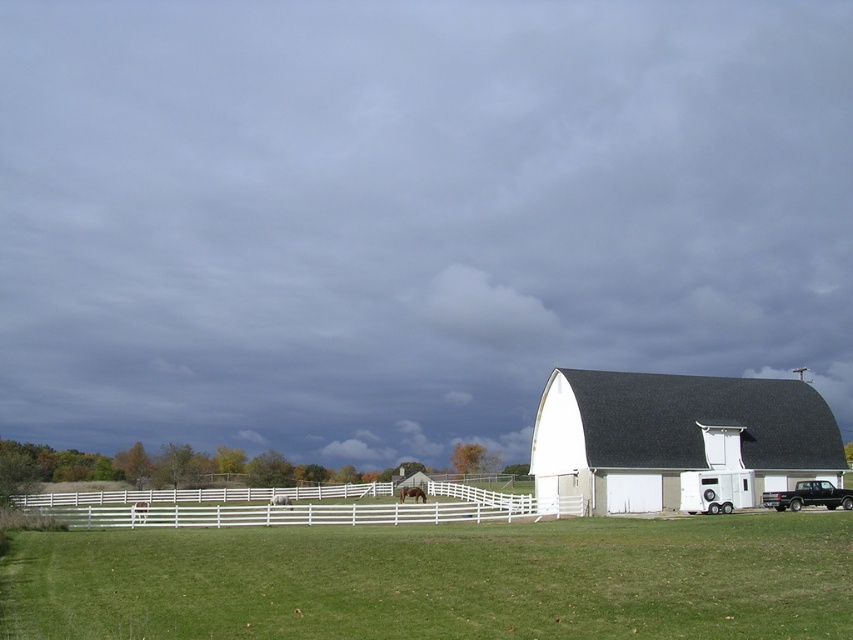
From the picture: Between white wooden fence at lower center and brown matte horse at center, which one is positioned higher?

white wooden fence at lower center is above.

Which is behind, point (142, 499) or point (418, 496)?

The point (142, 499) is behind.

This screenshot has width=853, height=640. Identify the location of white wooden fence at lower center. (289, 508).

Between brown matte horse at center and white glossy horse at center, which one is positioned lower?

white glossy horse at center is below.

Is brown matte horse at center wider than white glossy horse at center?

In fact, brown matte horse at center might be narrower than white glossy horse at center.

Which is behind, point (399, 490) or point (276, 493)?

The point (399, 490) is behind.

Find the location of a particular element. The width and height of the screenshot is (853, 640). brown matte horse at center is located at coordinates (410, 493).

Does white wooden fence at lower center have a lesser width compared to white glossy horse at center?

No, white wooden fence at lower center is not thinner than white glossy horse at center.

From the picture: Can you confirm if white wooden fence at lower center is positioned to the left of white glossy horse at center?

Yes, white wooden fence at lower center is to the left of white glossy horse at center.

This screenshot has height=640, width=853. In order to click on white wooden fence at lower center in this screenshot , I will do `click(289, 508)`.